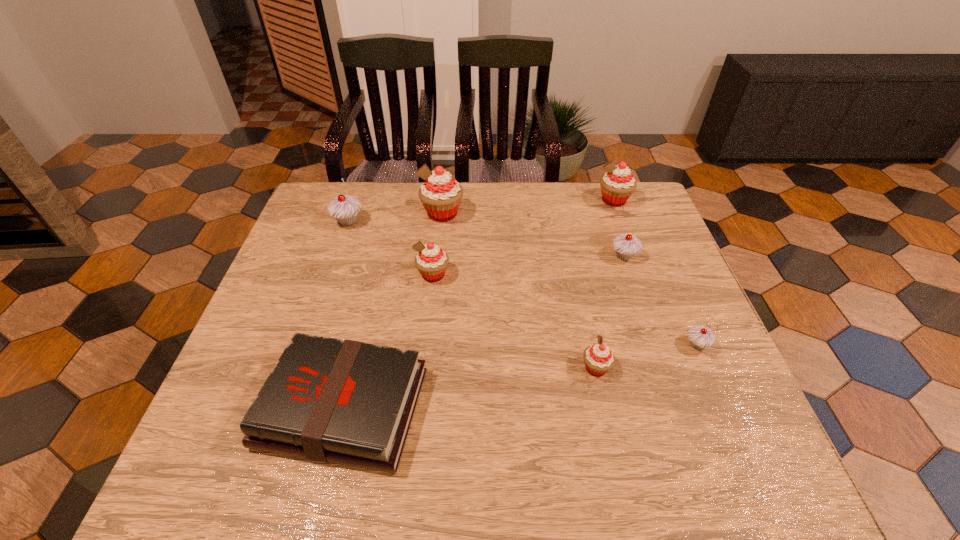
Image resolution: width=960 pixels, height=540 pixels. What are the coordinates of `free space between the second nearest gray cupcake and the tallest cupcake` in the screenshot? It's located at (533, 235).

Identify which object is the second nearest to the second smallest gray cupcake. Please provide its 2D coordinates. Your answer should be formatted as a tuple, i.e. [(x, y)], where the tuple contains the x and y coordinates of a point satisfying the conditions above.

[(700, 337)]

Point out which object is positioned as the third nearest to the hardback book. Please provide its 2D coordinates. Your answer should be formatted as a tuple, i.e. [(x, y)], where the tuple contains the x and y coordinates of a point satisfying the conditions above.

[(344, 209)]

Locate an element on the screen. The image size is (960, 540). cupcake that is the nearest to the smallest pink cupcake is located at coordinates (700, 337).

This screenshot has height=540, width=960. What are the coordinates of `cupcake that is the closest to the smallest gray cupcake` in the screenshot? It's located at (599, 359).

Point out which pink cupcake is positioned as the fourth nearest to the smallest gray cupcake. Please provide its 2D coordinates. Your answer should be formatted as a tuple, i.e. [(x, y)], where the tuple contains the x and y coordinates of a point satisfying the conditions above.

[(440, 194)]

I want to click on pink cupcake that stands as the closest to the third biggest pink cupcake, so (x=440, y=194).

This screenshot has height=540, width=960. In order to click on gray cupcake that stands as the closest to the third farthest pink cupcake in this screenshot , I will do `click(344, 209)`.

The width and height of the screenshot is (960, 540). What are the coordinates of `gray cupcake that stands as the closest to the fourth cupcake from left to right` in the screenshot? It's located at (700, 337).

Find the location of a particular element. free space that satisfies the following two spatial constraints: 1. on the back side of the third smallest pink cupcake; 2. on the right side of the biggest gray cupcake is located at coordinates (355, 200).